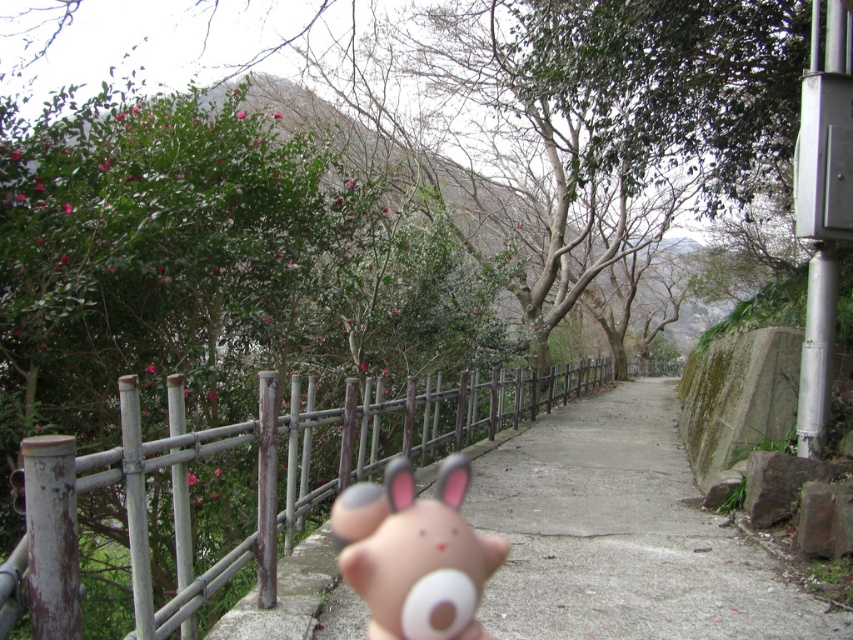
Is point (640, 426) positioned behind point (379, 572)?

Yes.

Is point (663, 564) closer to camera compared to point (404, 566)?

No, it is behind (404, 566).

The width and height of the screenshot is (853, 640). I want to click on concrete at center, so click(622, 532).

Is concrete at center smaller than wooden fence at center?

Indeed, concrete at center has a smaller size compared to wooden fence at center.

Can you confirm if concrete at center is positioned above wooden fence at center?

No, concrete at center is not above wooden fence at center.

What are the coordinates of `concrete at center` in the screenshot? It's located at (622, 532).

What are the coordinates of `concrete at center` in the screenshot? It's located at (622, 532).

Who is positioned more to the left, wooden fence at center or matte plastic toy at center?

matte plastic toy at center is more to the left.

Can you confirm if wooden fence at center is shorter than matte plastic toy at center?

In fact, wooden fence at center may be taller than matte plastic toy at center.

Is point (190, 531) positioned in front of point (447, 476)?

Yes.

The width and height of the screenshot is (853, 640). In order to click on wooden fence at center in this screenshot , I will do [293, 464].